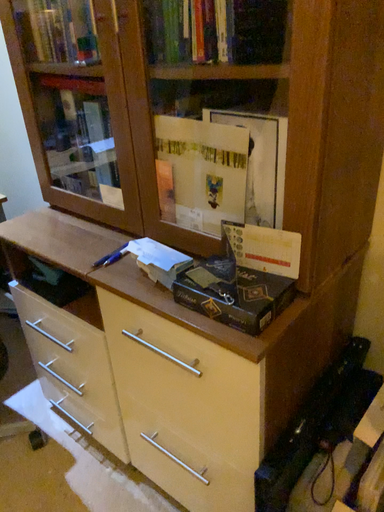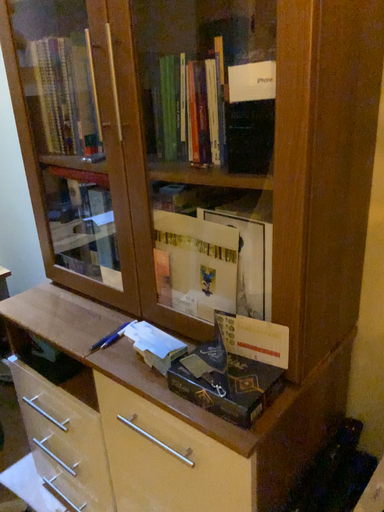
Question: Which way did the camera rotate in the video?

Choices:
 (A) rotated upward
 (B) rotated downward

Answer: (A)